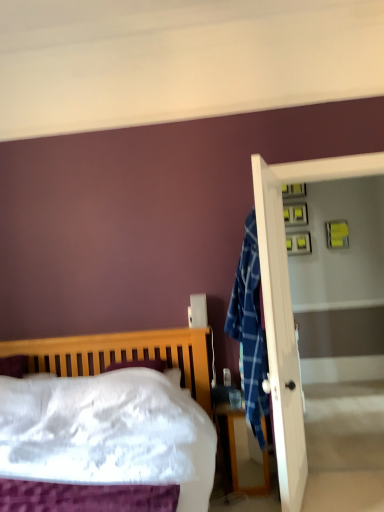
The width and height of the screenshot is (384, 512). What do you see at coordinates (122, 354) in the screenshot?
I see `wooden bed at left` at bounding box center [122, 354].

Image resolution: width=384 pixels, height=512 pixels. What are the coordinates of `wooden nightstand at lower right` in the screenshot? It's located at (242, 454).

Considering the positions of point (248, 485) and point (205, 381), is point (248, 485) closer or farther from the camera than point (205, 381)?

Point (248, 485) is positioned closer to the camera compared to point (205, 381).

From the image's perspective, is wooden nightstand at lower right above or below wooden bed at left?

Based on their image positions, wooden nightstand at lower right is located beneath wooden bed at left.

Is there a large distance between wooden nightstand at lower right and wooden bed at left?

No, wooden nightstand at lower right is in close proximity to wooden bed at left.

How many degrees apart are the facing directions of wooden nightstand at lower right and wooden bed at left?

The facing directions of wooden nightstand at lower right and wooden bed at left are 1.72 degrees apart.

The height and width of the screenshot is (512, 384). What are the coordinates of `screen door located behind the wooden bed at left` in the screenshot? It's located at (289, 303).

Considering the relative sizes of wooden bed at left and white glossy screen door at right in the image provided, is wooden bed at left shorter than white glossy screen door at right?

Indeed, wooden bed at left has a lesser height compared to white glossy screen door at right.

Between wooden bed at left and white glossy screen door at right, which one has smaller size?

With smaller size is white glossy screen door at right.

In the image, is wooden bed at left on the left side or the right side of white glossy screen door at right?

Based on their positions, wooden bed at left is located to the left of white glossy screen door at right.

Is white glossy screen door at right wider or thinner than wooden bed at left?

white glossy screen door at right is thinner than wooden bed at left.

Does white glossy screen door at right lie in front of wooden bed at left?

That is False.

From a real-world perspective, is white glossy screen door at right on wooden bed at left?

Yes, from a real-world perspective, white glossy screen door at right is over wooden bed at left

Does white glossy screen door at right touch wooden nightstand at lower right?

No, white glossy screen door at right is not touching wooden nightstand at lower right.

From the image's perspective, does white glossy screen door at right appear lower than wooden nightstand at lower right?

No.

This screenshot has width=384, height=512. In the image, there is a wooden nightstand at lower right. In order to click on screen door above it (from the image's perspective) in this screenshot , I will do `click(289, 303)`.

Which is in front, white glossy screen door at right or wooden nightstand at lower right?

wooden nightstand at lower right is closer to the camera.

Between wooden nightstand at lower right and white glossy screen door at right, which one has less height?

Standing shorter between the two is wooden nightstand at lower right.

Which object is positioned more to the left, wooden nightstand at lower right or white glossy screen door at right?

wooden nightstand at lower right.

Considering the relative sizes of wooden nightstand at lower right and white glossy screen door at right in the image provided, is wooden nightstand at lower right wider than white glossy screen door at right?

Yes, wooden nightstand at lower right is wider than white glossy screen door at right.

Are wooden bed at left and wooden nightstand at lower right beside each other?

No, wooden bed at left is not in contact with wooden nightstand at lower right.

In the scene shown: Which object is further away from the camera, wooden bed at left or wooden nightstand at lower right?

wooden nightstand at lower right is more distant.

Looking at this image, considering the sizes of objects wooden bed at left and wooden nightstand at lower right in the image provided, who is shorter, wooden bed at left or wooden nightstand at lower right?

wooden nightstand at lower right.

Is wooden bed at left bigger than wooden nightstand at lower right?

Indeed, wooden bed at left has a larger size compared to wooden nightstand at lower right.

Image resolution: width=384 pixels, height=512 pixels. I want to click on bed above the wooden nightstand at lower right (from the image's perspective), so click(x=122, y=354).

This screenshot has width=384, height=512. I want to click on screen door that appears above the wooden bed at left (from a real-world perspective), so click(289, 303).

Looking at the image, which one is located further to white glossy screen door at right, wooden nightstand at lower right or wooden bed at left?

wooden bed at left is positioned further to the anchor white glossy screen door at right.

Based on their spatial positions, is wooden bed at left or white glossy screen door at right further from wooden nightstand at lower right?

Based on the image, white glossy screen door at right appears to be further to wooden nightstand at lower right.

Based on their spatial positions, is wooden bed at left or wooden nightstand at lower right closer to white glossy screen door at right?

The object closer to white glossy screen door at right is wooden nightstand at lower right.

From the image, which object appears to be farther from wooden bed at left, white glossy screen door at right or wooden nightstand at lower right?

white glossy screen door at right is positioned further to the anchor wooden bed at left.

Which object lies nearer to the anchor point wooden nightstand at lower right, white glossy screen door at right or wooden bed at left?

The object closer to wooden nightstand at lower right is wooden bed at left.

When comparing their distances from wooden bed at left, does wooden nightstand at lower right or white glossy screen door at right seem closer?

wooden nightstand at lower right lies closer to wooden bed at left than the other object.

Locate an element on the screen. The height and width of the screenshot is (512, 384). nightstand located between wooden bed at left and white glossy screen door at right in the depth direction is located at coordinates (242, 454).